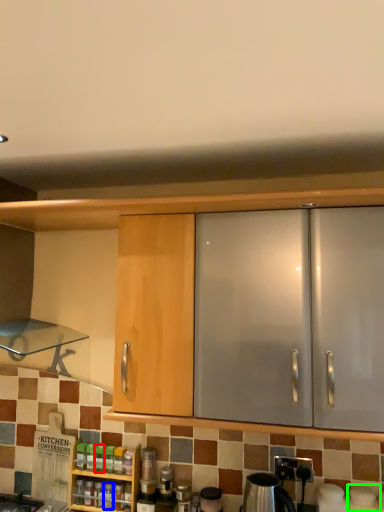
Question: Based on their relative distances, which object is farther from bottle (highlighted by a red box)? Choose from bottle (highlighted by a blue box) and appliance (highlighted by a green box).

Choices:
 (A) bottle
 (B) appliance

Answer: (B)